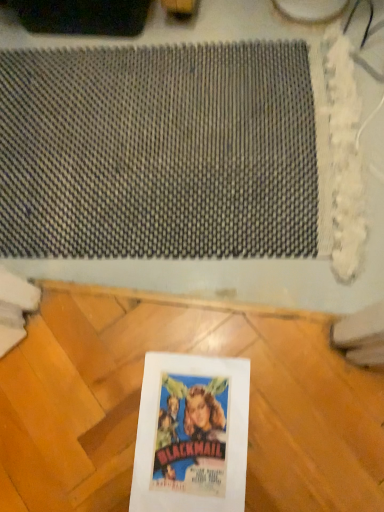
I want to click on empty space that is ontop of white paper at center, so click(189, 442).